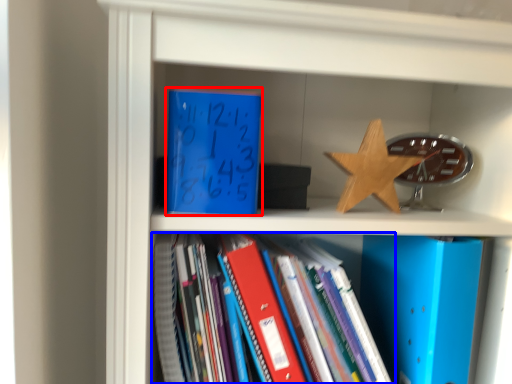
Question: Which object appears closest to the camera in this image, paperback book (highlighted by a red box) or book (highlighted by a blue box)?

Choices:
 (A) paperback book
 (B) book

Answer: (B)